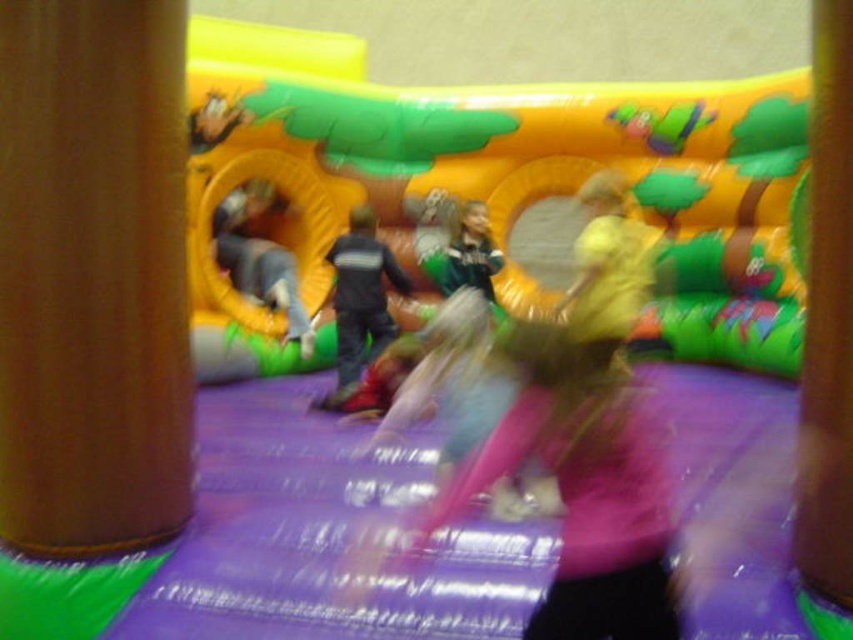
Question: Which point appears closest to the camera in this image?

Choices:
 (A) (28, 65)
 (B) (252, 90)

Answer: (A)

Question: Among these points, which one is farthest from the camera?

Choices:
 (A) (518, 150)
 (B) (4, 385)
 (C) (840, 292)

Answer: (A)

Question: Which object is positioned farthest from the brown wood pillar at center left?

Choices:
 (A) brown leather pillar at left
 (B) purple fabric slide at center

Answer: (B)

Question: Is purple fabric slide at center to the left of brown wood pillar at center left from the viewer's perspective?

Choices:
 (A) no
 (B) yes

Answer: (B)

Question: Can you confirm if brown leather pillar at left is positioned below brown wood pillar at center left?

Choices:
 (A) yes
 (B) no

Answer: (B)

Question: Can you confirm if brown leather pillar at left is positioned above brown wood pillar at center left?

Choices:
 (A) no
 (B) yes

Answer: (B)